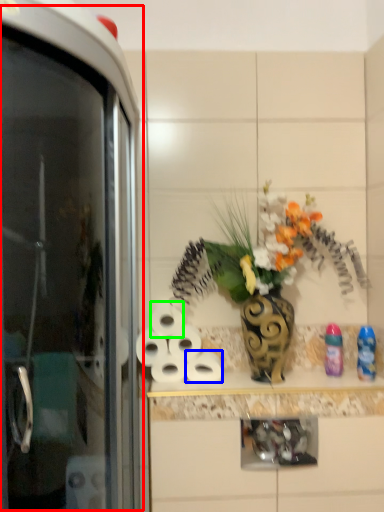
Question: Based on their relative distances, which object is farther from screen door (highlighted by a red box)? Choose from toilet paper (highlighted by a blue box) and toilet paper (highlighted by a green box).

Choices:
 (A) toilet paper
 (B) toilet paper

Answer: (A)